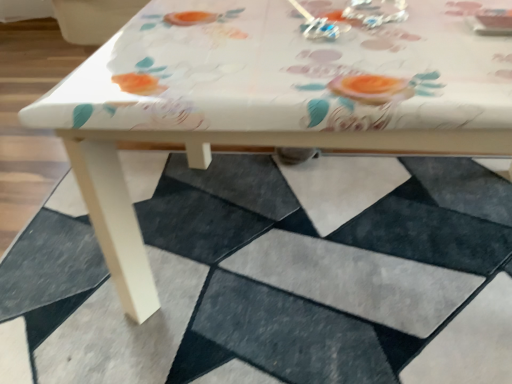
Locate an element on the screen. spots to the right of metallic silver earrings at upper center is located at coordinates (415, 15).